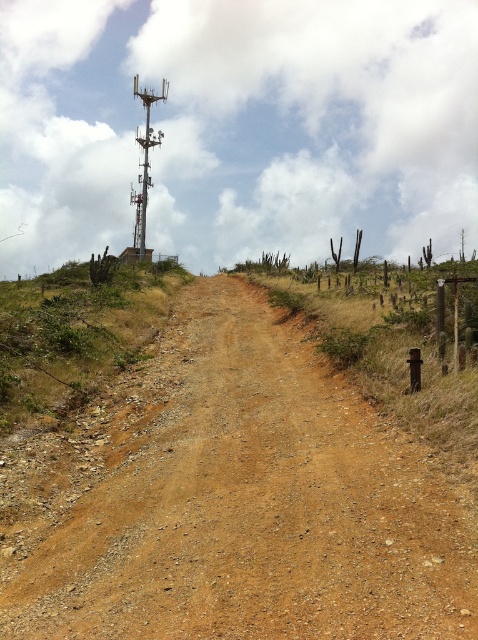
Measure the distance from brown gravelly dirt track at center to green grassy hillside at upper left.

3.96 meters

Between brown gravelly dirt track at center and green grassy hillside at upper left, which one is positioned lower?

brown gravelly dirt track at center is lower down.

The height and width of the screenshot is (640, 478). What are the coordinates of `brown gravelly dirt track at center` in the screenshot? It's located at (232, 500).

Where is `brown gravelly dirt track at center`? The image size is (478, 640). brown gravelly dirt track at center is located at coordinates (232, 500).